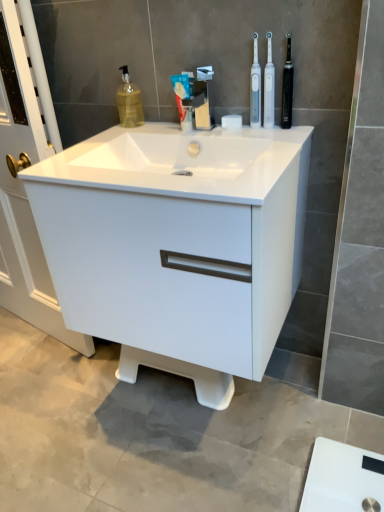
Describe the element at coordinates (183, 99) in the screenshot. I see `white matte toothpaste at center` at that location.

Measure the distance between satin nickel faucet at center and camera.

satin nickel faucet at center and camera are 3.99 feet apart.

The height and width of the screenshot is (512, 384). In order to click on translucent yellow liquid at upper left in this screenshot , I will do `click(129, 102)`.

Are white glossy cabinet at center and white matte toothpaste at center far apart?

They are positioned close to each other.

From the image's perspective, is white glossy cabinet at center on top of white matte toothpaste at center?

No, from the image's perspective, white glossy cabinet at center is not over white matte toothpaste at center.

Where is `bathroom cabinet in front of the white matte toothpaste at center`? This screenshot has width=384, height=512. bathroom cabinet in front of the white matte toothpaste at center is located at coordinates (177, 245).

Can you confirm if white glossy cabinet at center is bigger than white matte toothpaste at center?

Yes, white glossy cabinet at center is bigger than white matte toothpaste at center.

Based on the photo, from a real-world perspective, is black rubber toothbrush at upper right below white glossy sink at center?

Incorrect, from a real-world perspective, black rubber toothbrush at upper right is higher than white glossy sink at center.

Would you say black rubber toothbrush at upper right is outside white glossy sink at center?

That's correct, black rubber toothbrush at upper right is outside of white glossy sink at center.

Considering the positions of objects black rubber toothbrush at upper right and white glossy sink at center in the image provided, who is behind, black rubber toothbrush at upper right or white glossy sink at center?

black rubber toothbrush at upper right is behind.

Is translucent yellow liquid at upper left spatially inside white plastic toothbrush at upper right, placed as the first toothbrush when sorted from left to right, or outside of it?

translucent yellow liquid at upper left exists outside the volume of white plastic toothbrush at upper right, placed as the first toothbrush when sorted from left to right.

Can you tell me how much translucent yellow liquid at upper left and white plastic toothbrush at upper right, placed as the first toothbrush when sorted from left to right, differ in facing direction?

There is a 2.3-degree angle between the facing directions of translucent yellow liquid at upper left and white plastic toothbrush at upper right, placed as the first toothbrush when sorted from left to right.

Would you consider translucent yellow liquid at upper left to be distant from white plastic toothbrush at upper right, placed as the first toothbrush when sorted from left to right?

No, there isn't a large distance between translucent yellow liquid at upper left and white plastic toothbrush at upper right, placed as the first toothbrush when sorted from left to right.

From a real-world perspective, which object stands above the other?

white plastic toothbrush at upper right, which is the 2th toothbrush in left-to-right order, from a real-world perspective.

From the image's perspective, between white plastic toothbrush at upper right, which is counted as the first toothbrush, starting from the right, and white glossy sink at center, which one is located above?

white plastic toothbrush at upper right, which is counted as the first toothbrush, starting from the right, from the image's perspective.

Would you consider white plastic toothbrush at upper right, which is counted as the first toothbrush, starting from the right, to be distant from white glossy sink at center?

white plastic toothbrush at upper right, which is counted as the first toothbrush, starting from the right, is near white glossy sink at center, not far away.

Is the depth of white matte toothpaste at center less than that of white plastic toothbrush at upper right, which is the 2th toothbrush in left-to-right order?

No, it is not.

Considering the positions of objects white matte toothpaste at center and white plastic toothbrush at upper right, which is the 2th toothbrush in left-to-right order, in the image provided, who is more to the left, white matte toothpaste at center or white plastic toothbrush at upper right, which is the 2th toothbrush in left-to-right order,?

Positioned to the left is white matte toothpaste at center.

From a real-world perspective, is white matte toothpaste at center beneath white plastic toothbrush at upper right, which is counted as the first toothbrush, starting from the right?

Yes, from a real-world perspective, white matte toothpaste at center is below white plastic toothbrush at upper right, which is counted as the first toothbrush, starting from the right.

From the image's perspective, does white glossy sink at center appear higher than white glossy cabinet at center?

Yes.

Which object is wider, white glossy sink at center or white glossy cabinet at center?

Wider between the two is white glossy sink at center.

Considering the sizes of white glossy sink at center and white glossy cabinet at center in the image, is white glossy sink at center taller or shorter than white glossy cabinet at center?

white glossy sink at center is shorter than white glossy cabinet at center.

From a real-world perspective, which object stands above the other?

In real-world perspective, white glossy sink at center is above.

Can you confirm if translucent yellow liquid at upper left is smaller than satin nickel faucet at center?

Correct, translucent yellow liquid at upper left occupies less space than satin nickel faucet at center.

Is translucent yellow liquid at upper left thinner than satin nickel faucet at center?

Correct, the width of translucent yellow liquid at upper left is less than that of satin nickel faucet at center.

Considering the relative positions of translucent yellow liquid at upper left and satin nickel faucet at center in the image provided, is translucent yellow liquid at upper left behind satin nickel faucet at center?

Yes, it is behind satin nickel faucet at center.

From a real-world perspective, is translucent yellow liquid at upper left physically below satin nickel faucet at center?

No, from a real-world perspective, translucent yellow liquid at upper left is not below satin nickel faucet at center.

This screenshot has height=512, width=384. Identify the location of toothpaste located above the white glossy cabinet at center (from a real-world perspective). (183, 99).

Where is `counter top below the black rubber toothbrush at upper right (from a real-world perspective)`? The image size is (384, 512). counter top below the black rubber toothbrush at upper right (from a real-world perspective) is located at coordinates (181, 162).

Looking at the image, which one is located closer to white matte toothpaste at center, black rubber toothbrush at upper right or white glossy sink at center?

The object closer to white matte toothpaste at center is white glossy sink at center.

Looking at the image, which one is located further to white glossy sink at center, white plastic toothbrush at upper right, the second toothbrush positioned from the right, or translucent yellow liquid at upper left?

translucent yellow liquid at upper left.

Looking at the image, which one is located closer to white matte toothpaste at center, translucent yellow liquid at upper left or white plastic toothbrush at upper right, placed as the first toothbrush when sorted from left to right?

The object closer to white matte toothpaste at center is white plastic toothbrush at upper right, placed as the first toothbrush when sorted from left to right.

Looking at the image, which one is located closer to white glossy cabinet at center, white plastic toothbrush at upper right, placed as the first toothbrush when sorted from left to right, or white glossy sink at center?

The object closer to white glossy cabinet at center is white glossy sink at center.

From the image, which object appears to be farther from black rubber toothbrush at upper right, satin nickel faucet at center or white glossy cabinet at center?

white glossy cabinet at center.

From the picture: When comparing their distances from black rubber toothbrush at upper right, does white plastic toothbrush at upper right, the second toothbrush positioned from the right, or satin nickel faucet at center seem further?

satin nickel faucet at center is further to black rubber toothbrush at upper right.

Looking at the image, which one is located further to satin nickel faucet at center, white plastic toothbrush at upper right, the second toothbrush positioned from the right, or translucent yellow liquid at upper left?

Among the two, translucent yellow liquid at upper left is located further to satin nickel faucet at center.

Looking at this image, considering their positions, is translucent yellow liquid at upper left positioned closer to white plastic toothbrush at upper right, which is counted as the first toothbrush, starting from the right, than satin nickel faucet at center?

satin nickel faucet at center is positioned closer to the anchor white plastic toothbrush at upper right, which is counted as the first toothbrush, starting from the right.

Identify the location of counter top that lies between white plastic toothbrush at upper right, placed as the first toothbrush when sorted from left to right, and white glossy cabinet at center from top to bottom. (181, 162).

This screenshot has width=384, height=512. Identify the location of toothbrush between white glossy sink at center and white plastic toothbrush at upper right, placed as the first toothbrush when sorted from left to right, along the z-axis. (269, 87).

Locate an element on the screen. This screenshot has width=384, height=512. toothpaste between translucent yellow liquid at upper left and white plastic toothbrush at upper right, the second toothbrush positioned from the right is located at coordinates (183, 99).

I want to click on faucet situated between white matte toothpaste at center and black rubber toothbrush at upper right from left to right, so click(203, 98).